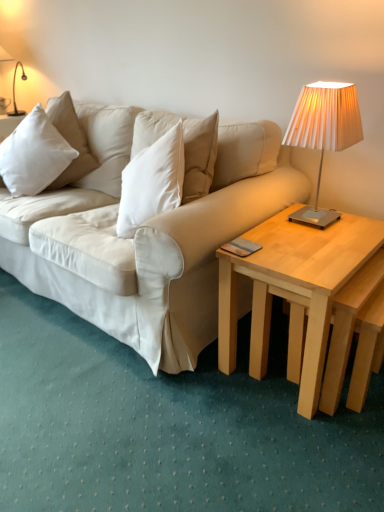
Question: Is light wood/natural wood coffee table at right facing towards white soft pillow at left?

Choices:
 (A) no
 (B) yes

Answer: (A)

Question: Can you confirm if light wood/natural wood coffee table at right is smaller than white soft pillow at left?

Choices:
 (A) yes
 (B) no

Answer: (B)

Question: From the image's perspective, would you say light wood/natural wood coffee table at right is shown under white soft pillow at left?

Choices:
 (A) yes
 (B) no

Answer: (A)

Question: Considering the relative positions of light wood/natural wood coffee table at right and white soft pillow at left in the image provided, is light wood/natural wood coffee table at right to the right of white soft pillow at left from the viewer's perspective?

Choices:
 (A) no
 (B) yes

Answer: (B)

Question: Is light wood/natural wood coffee table at right taller than white soft pillow at left?

Choices:
 (A) yes
 (B) no

Answer: (A)

Question: Is white soft pillow at left taller or shorter than metallic pleated lampshade at upper right?

Choices:
 (A) tall
 (B) short

Answer: (B)

Question: Would you say white soft pillow at left is inside or outside metallic pleated lampshade at upper right?

Choices:
 (A) outside
 (B) inside

Answer: (A)

Question: Is white soft pillow at left to the left or to the right of metallic pleated lampshade at upper right in the image?

Choices:
 (A) right
 (B) left

Answer: (B)

Question: In terms of size, does white soft pillow at left appear bigger or smaller than metallic pleated lampshade at upper right?

Choices:
 (A) big
 (B) small

Answer: (A)

Question: Is metallic pleated lampshade at upper right bigger or smaller than light wood/natural wood coffee table at right?

Choices:
 (A) big
 (B) small

Answer: (B)

Question: From the image's perspective, is metallic pleated lampshade at upper right positioned above or below light wood/natural wood coffee table at right?

Choices:
 (A) above
 (B) below

Answer: (A)

Question: Is metallic pleated lampshade at upper right situated inside light wood/natural wood coffee table at right or outside?

Choices:
 (A) outside
 (B) inside

Answer: (A)

Question: Considering their positions, is metallic pleated lampshade at upper right located in front of or behind light wood/natural wood coffee table at right?

Choices:
 (A) behind
 (B) front

Answer: (A)

Question: Does point (31, 172) appear closer or farther from the camera than point (329, 407)?

Choices:
 (A) closer
 (B) farther

Answer: (B)

Question: Do you think white soft pillow at left is within light wood/natural wood coffee table at right, or outside of it?

Choices:
 (A) outside
 (B) inside

Answer: (A)